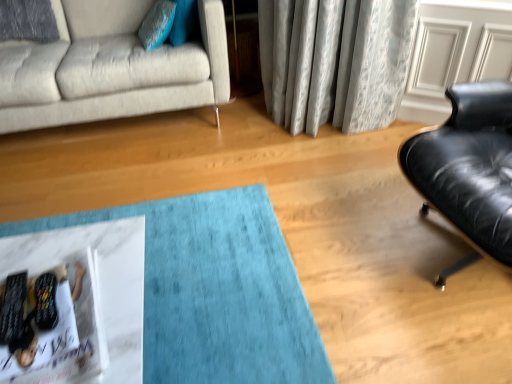
Question: Is white glossy magazine at lower left to the right of light gray fabric couch at upper left from the viewer's perspective?

Choices:
 (A) yes
 (B) no

Answer: (A)

Question: Is white glossy magazine at lower left in front of light gray fabric couch at upper left?

Choices:
 (A) no
 (B) yes

Answer: (B)

Question: Is white glossy magazine at lower left not inside light gray fabric couch at upper left?

Choices:
 (A) yes
 (B) no

Answer: (A)

Question: Is white glossy magazine at lower left oriented away from light gray fabric couch at upper left?

Choices:
 (A) yes
 (B) no

Answer: (B)

Question: From a real-world perspective, is white glossy magazine at lower left on top of light gray fabric couch at upper left?

Choices:
 (A) yes
 (B) no

Answer: (B)

Question: Is teal fabric pillow at upper left taller or shorter than light gray fabric couch at upper left?

Choices:
 (A) tall
 (B) short

Answer: (B)

Question: Choose the correct answer: Is teal fabric pillow at upper left inside light gray fabric couch at upper left or outside it?

Choices:
 (A) inside
 (B) outside

Answer: (A)

Question: Is point (156, 33) closer or farther from the camera than point (66, 48)?

Choices:
 (A) closer
 (B) farther

Answer: (A)

Question: Considering the positions of teal fabric pillow at upper left and light gray fabric couch at upper left in the image, is teal fabric pillow at upper left wider or thinner than light gray fabric couch at upper left?

Choices:
 (A) wide
 (B) thin

Answer: (B)

Question: Based on their sizes in the image, would you say teal fabric pillow at upper left is bigger or smaller than white glossy magazine at lower left?

Choices:
 (A) small
 (B) big

Answer: (B)

Question: In terms of width, does teal fabric pillow at upper left look wider or thinner when compared to white glossy magazine at lower left?

Choices:
 (A) wide
 (B) thin

Answer: (B)

Question: From the image's perspective, is teal fabric pillow at upper left above or below white glossy magazine at lower left?

Choices:
 (A) below
 (B) above

Answer: (B)

Question: Relative to white glossy magazine at lower left, is teal fabric pillow at upper left in front or behind?

Choices:
 (A) behind
 (B) front

Answer: (A)

Question: In the image, is white glossy magazine at lower left on the left side or the right side of teal fabric pillow at upper left?

Choices:
 (A) right
 (B) left

Answer: (A)

Question: From their relative heights in the image, would you say white glossy magazine at lower left is taller or shorter than teal fabric pillow at upper left?

Choices:
 (A) tall
 (B) short

Answer: (B)